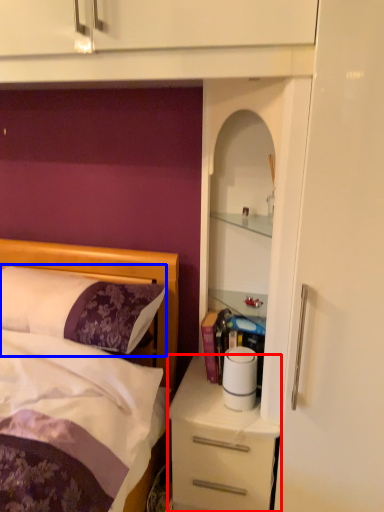
Question: Among these objects, which one is farthest to the camera, desk (highlighted by a red box) or pillow (highlighted by a blue box)?

Choices:
 (A) desk
 (B) pillow

Answer: (A)